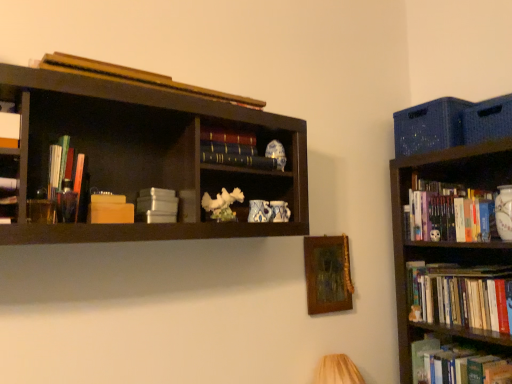
Question: Which direction should I rotate to look at wooden book at upper center, the 1th book when ordered from top to bottom, — up or down?

Choices:
 (A) down
 (B) up

Answer: (B)

Question: Is there a large distance between wooden picture frame at center and hardcover book at center, which is the 6th book in bottom-to-top order?

Choices:
 (A) yes
 (B) no

Answer: (B)

Question: Is wooden picture frame at center with hardcover book at center, which is the 6th book in bottom-to-top order?

Choices:
 (A) no
 (B) yes

Answer: (A)

Question: From a real-world perspective, does wooden picture frame at center stand above hardcover book at center, which is the 6th book in bottom-to-top order?

Choices:
 (A) no
 (B) yes

Answer: (A)

Question: Can you confirm if wooden picture frame at center is shorter than hardcover book at center, which is the 5th book in left-to-right order?

Choices:
 (A) yes
 (B) no

Answer: (B)

Question: Does wooden picture frame at center contain hardcover book at center, which is the 5th book in left-to-right order?

Choices:
 (A) yes
 (B) no

Answer: (B)

Question: Is wooden picture frame at center turned away from hardcover book at center, which is the third book in top-to-bottom order?

Choices:
 (A) yes
 (B) no

Answer: (B)

Question: Can you confirm if matte black bookshelf at left is positioned to the right of hardcover book at lower right, acting as the 2th book starting from the right?

Choices:
 (A) no
 (B) yes

Answer: (A)

Question: Is matte black bookshelf at left directly adjacent to hardcover book at lower right, the first book from the bottom?

Choices:
 (A) no
 (B) yes

Answer: (A)

Question: Considering the relative positions of matte black bookshelf at left and hardcover book at lower right, which is the eighth book from top to bottom, in the image provided, is matte black bookshelf at left behind hardcover book at lower right, which is the eighth book from top to bottom,?

Choices:
 (A) no
 (B) yes

Answer: (A)

Question: Is matte black bookshelf at left smaller than hardcover book at lower right, acting as the 2th book starting from the right?

Choices:
 (A) no
 (B) yes

Answer: (B)

Question: From the image's perspective, is matte black bookshelf at left below hardcover book at lower right, which is the eighth book from top to bottom?

Choices:
 (A) no
 (B) yes

Answer: (A)

Question: Can you confirm if matte black bookshelf at left is bigger than hardcover book at lower right, which is the eighth book from top to bottom?

Choices:
 (A) yes
 (B) no

Answer: (B)

Question: Is hardcover book at center, which is the 6th book in bottom-to-top order, shorter than white matte book at upper left, acting as the second book starting from the top?

Choices:
 (A) no
 (B) yes

Answer: (B)